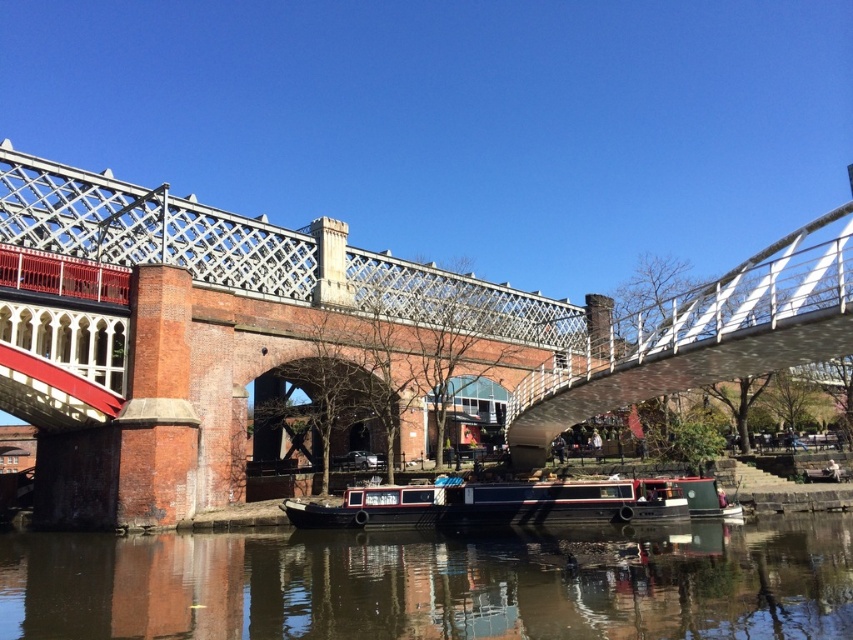
You are standing at the edge of the canal and want to cross to the other side. The metallic silver pedestrian bridge at center is your only option. Can you confirm the exact coordinates of the bridge to ensure safe passage?

The metallic silver pedestrian bridge at center is located at coordinates point [334,332], so you can safely navigate towards that point to cross the canal.

You are standing on the bridge and want to take a photo of the brown reflective water at center and the black polished wood boat at center. Which object should you aim your camera towards if you want to capture the one that is positioned to the left?

The brown reflective water at center is to the left of the black polished wood boat at center, so you should aim your camera towards the brown reflective water at center to capture the one on the left.